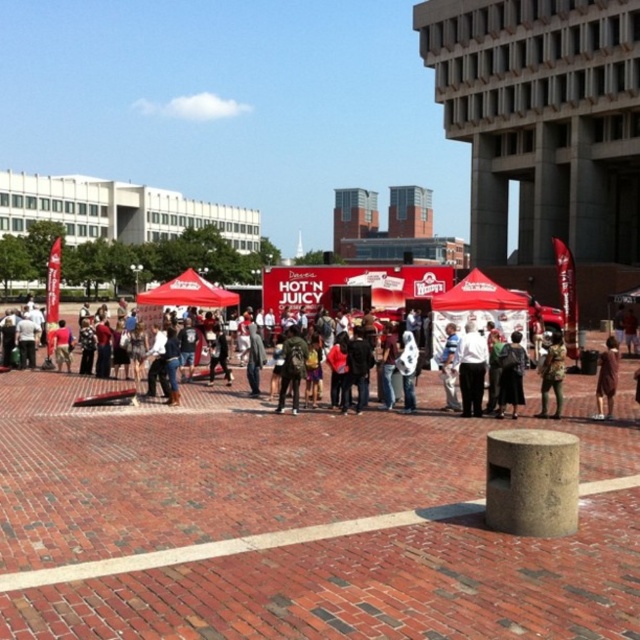
Question: Among these objects, which one is nearest to the camera?

Choices:
 (A) matte red canopy at center
 (B) brown fabric dress at center
 (C) red fabric canopy at center

Answer: (B)

Question: Considering the real-world distances, which object is farthest from the white shirt at center?

Choices:
 (A) matte red canopy at center
 (B) brown leather jacket at center

Answer: (A)

Question: Does dark brown leather jacket at center have a lesser width compared to brown fabric dress at center?

Choices:
 (A) yes
 (B) no

Answer: (B)

Question: From the image, what is the correct spatial relationship of matte red canopy at center in relation to brown fabric dress at center?

Choices:
 (A) above
 (B) below

Answer: (A)

Question: Estimate the real-world distances between objects in this image. Which object is farther from the brown fabric dress at center?

Choices:
 (A) brown leather jacket at center
 (B) green backpack at center
 (C) camouflage jacket at center

Answer: (B)

Question: Does red fabric canopy at center come behind white shirt at center?

Choices:
 (A) yes
 (B) no

Answer: (A)